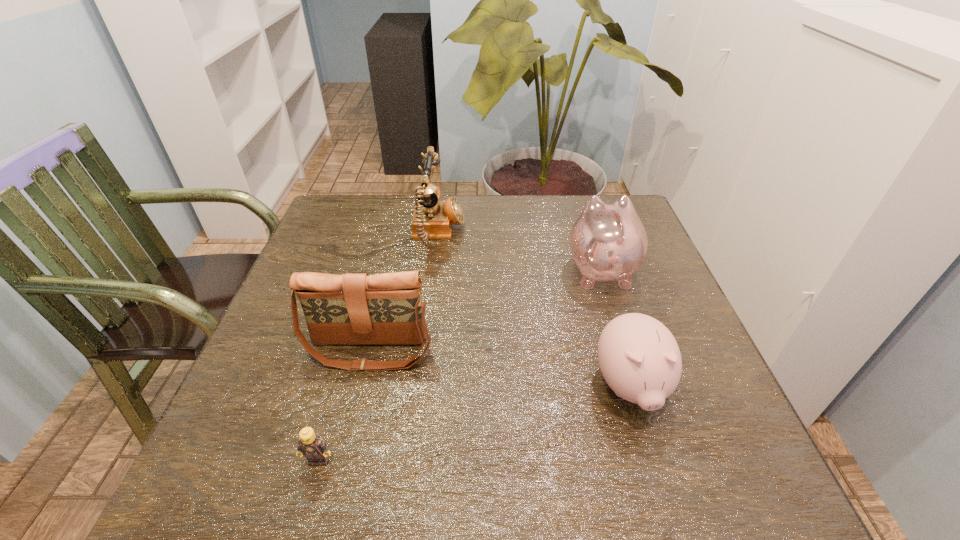
Identify the location of telephone. The width and height of the screenshot is (960, 540). (433, 218).

Find the location of a particular element. The image size is (960, 540). the taller piggy bank is located at coordinates click(x=608, y=241).

At what (x,y) coordinates should I click in order to perform the action: click on shoulder bag. Please return your answer as a coordinate pair (x, y). Looking at the image, I should click on (350, 309).

Where is `the shorter piggy bank`? The image size is (960, 540). the shorter piggy bank is located at coordinates (639, 358).

This screenshot has height=540, width=960. I want to click on the nearer piggy bank, so click(639, 358).

Find the location of a particular element. This screenshot has width=960, height=540. the shortest object is located at coordinates (311, 445).

You are a GUI agent. You are given a task and a screenshot of the screen. Output one action in this format:
    pyautogui.click(x=<x>, y=<y>)
    Task: Click on the nearest object
    
    Given the screenshot: What is the action you would take?
    pyautogui.click(x=311, y=445)

The width and height of the screenshot is (960, 540). In order to click on vacant space situated 0.050m on the dial number of the telephone in this screenshot , I will do `click(482, 233)`.

Locate an element on the screen. vacant region located 0.250m on the front facing side of the taller piggy bank is located at coordinates (578, 197).

Where is `vacant region located on the front facing side of the taller piggy bank`? The height and width of the screenshot is (540, 960). vacant region located on the front facing side of the taller piggy bank is located at coordinates (589, 234).